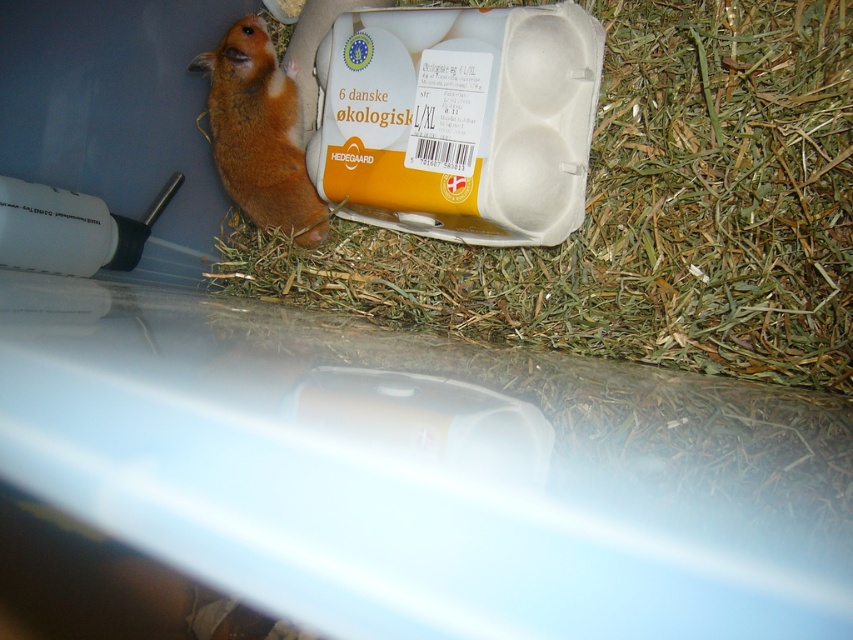
Who is shorter, green straw at upper center or orange fur hamster at left?

orange fur hamster at left is shorter.

Does green straw at upper center have a lesser height compared to orange fur hamster at left?

Incorrect, green straw at upper center's height does not fall short of orange fur hamster at left's.

Where is `green straw at upper center`? The width and height of the screenshot is (853, 640). green straw at upper center is located at coordinates (648, 212).

Identify the location of green straw at upper center. This screenshot has height=640, width=853. (648, 212).